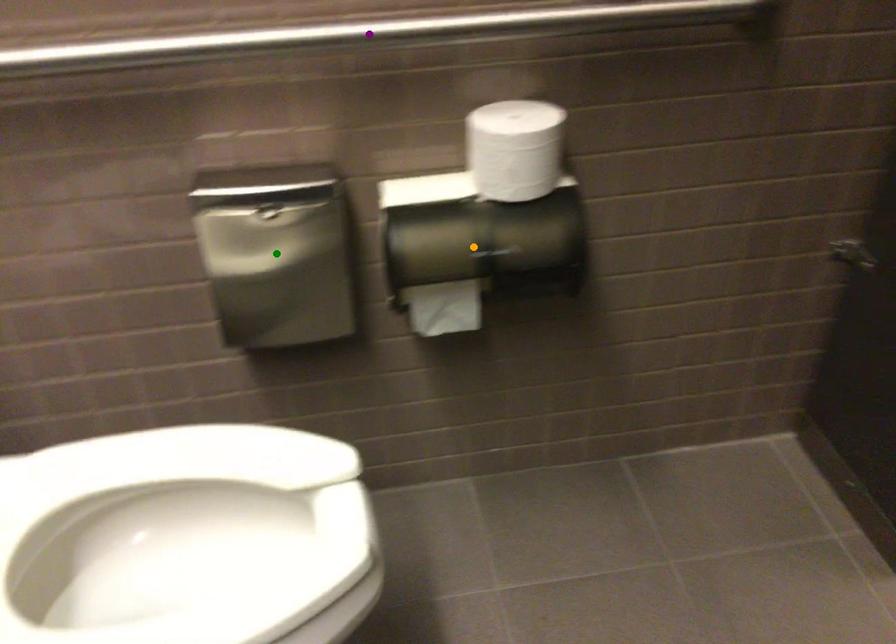
Looking at this image, order these from nearest to farthest:
purple point, orange point, green point

purple point
orange point
green point